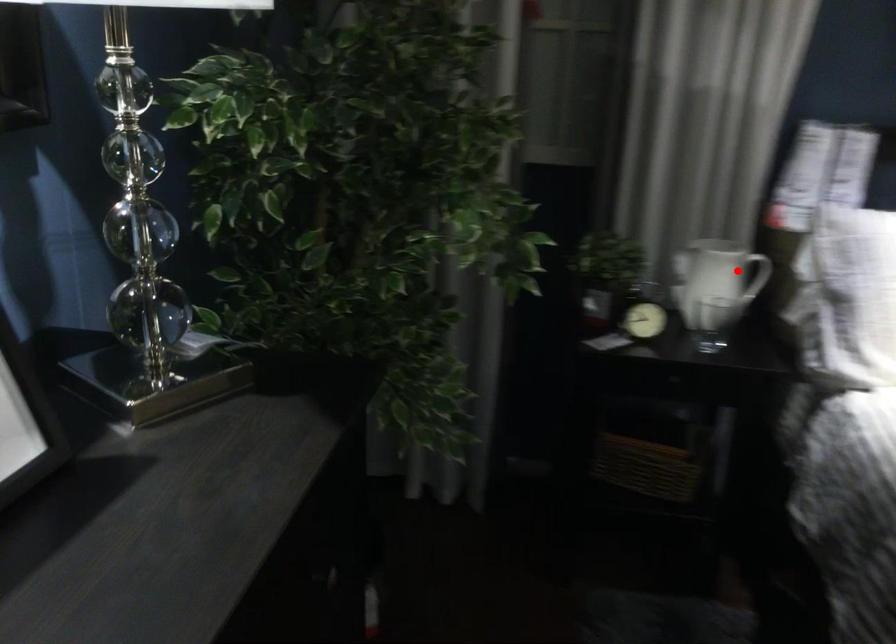
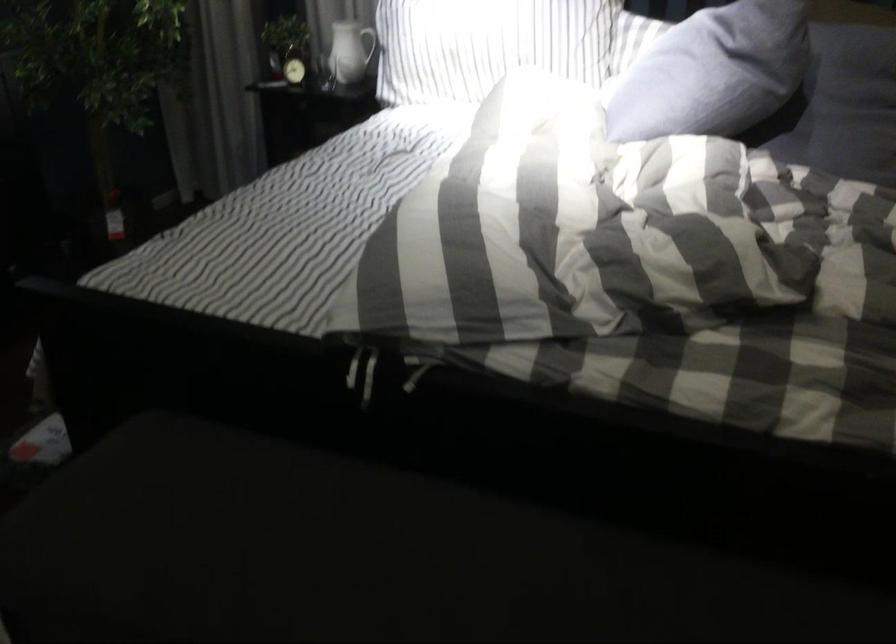
The point at the highlighted location is marked in the first image. Where is the corresponding point in the second image?

(371, 44)